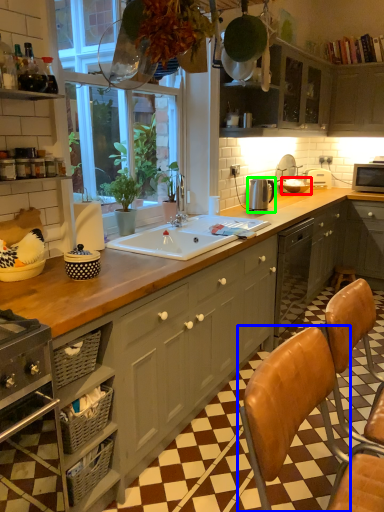
Question: Based on their relative distances, which object is farther from appliance (highlighted by a red box)? Choose from chair (highlighted by a blue box) and appliance (highlighted by a green box).

Choices:
 (A) chair
 (B) appliance

Answer: (A)